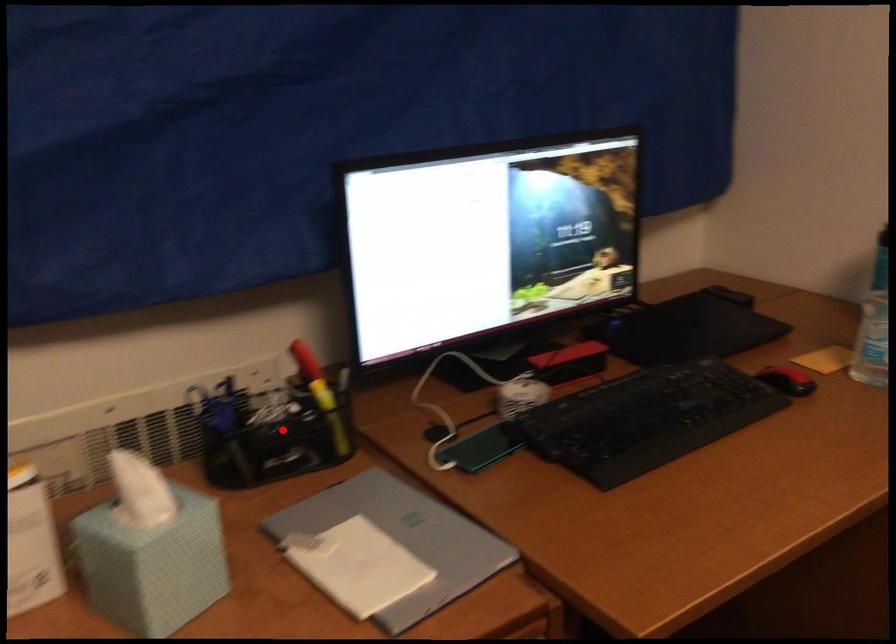
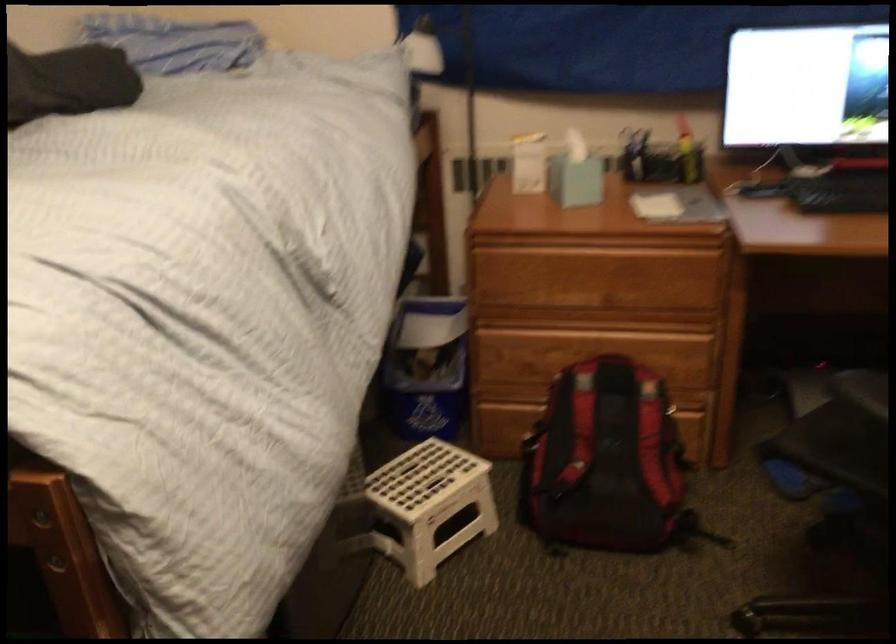
Question: I am providing you with two images of the same scene from different viewpoints. In image1, a red point is highlighted. Considering the same 3D point in image2, which of the following is correct?

Choices:
 (A) It is closer
 (B) It is farther

Answer: (B)